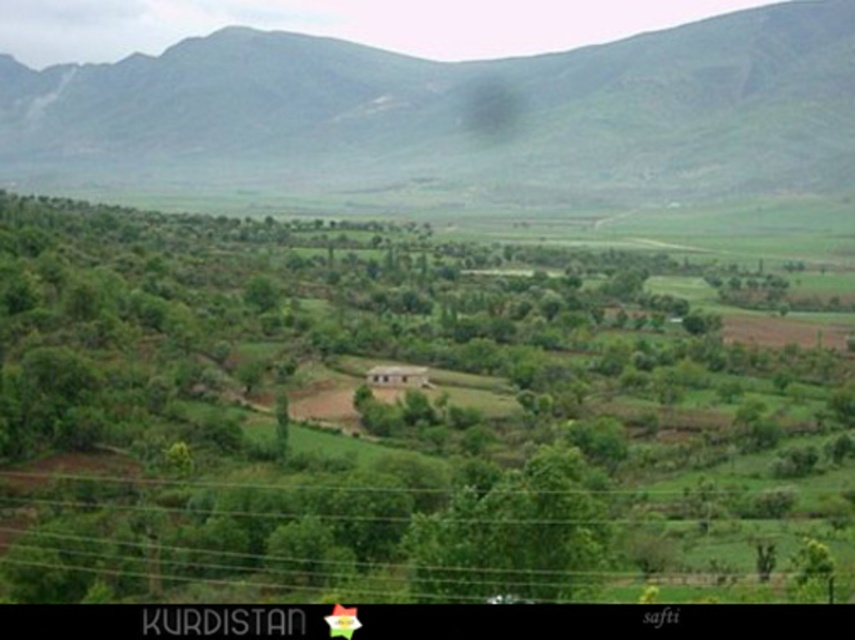
You are a hiker standing at the base of the green grassy mountain at upper center and want to reach the green leafy tree at center. Which direction should you move to get there?

You should move to the right to reach the green leafy tree at center because it is located to the right of the green grassy mountain at upper center.

You are standing at the origin point of the coordinate system in the image. The origin is at the bottom left corner of the image. You want to walk towards the green leafy tree at center. In which direction should you move first?

Since the green leafy tree at center is located at coordinate point (392, 419), you should first move towards the right and slightly upwards from the origin to reach it.